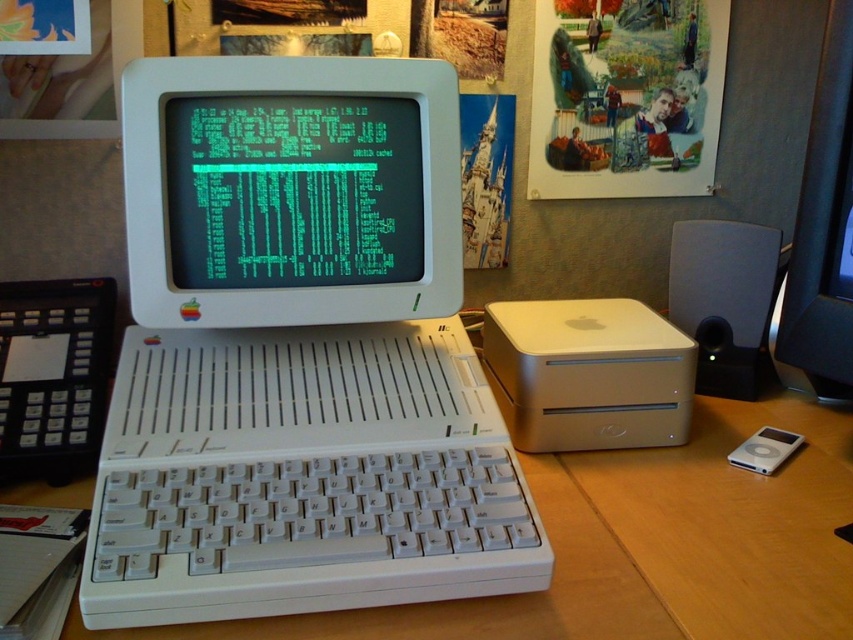
Is the position of white plastic monitor at center less distant than that of matte black speaker at right?

Yes, it is in front of matte black speaker at right.

Does white plastic monitor at center appear over matte black speaker at right?

Indeed, white plastic monitor at center is positioned over matte black speaker at right.

Is point (149, 246) closer to camera compared to point (749, 300)?

Yes.

Identify the location of white plastic monitor at center. (289, 189).

Can you confirm if white plastic computer at center is taller than white plastic monitor at center?

Correct, white plastic computer at center is much taller as white plastic monitor at center.

Does point (369, 408) come in front of point (173, 179)?

Yes, it is in front of point (173, 179).

You are a GUI agent. You are given a task and a screenshot of the screen. Output one action in this format:
    pyautogui.click(x=<x>, y=<y>)
    Task: Click on the white plastic computer at center
    The height and width of the screenshot is (640, 853).
    Given the screenshot: What is the action you would take?
    pyautogui.click(x=297, y=353)

Is white plastic computer at center to the left of matte black speaker at right from the viewer's perspective?

Correct, you'll find white plastic computer at center to the left of matte black speaker at right.

How far apart are white plastic computer at center and matte black speaker at right?

The distance of white plastic computer at center from matte black speaker at right is 18.22 inches.

Is point (503, 484) closer to viewer compared to point (717, 237)?

Yes.

This screenshot has width=853, height=640. I want to click on white plastic computer at center, so click(297, 353).